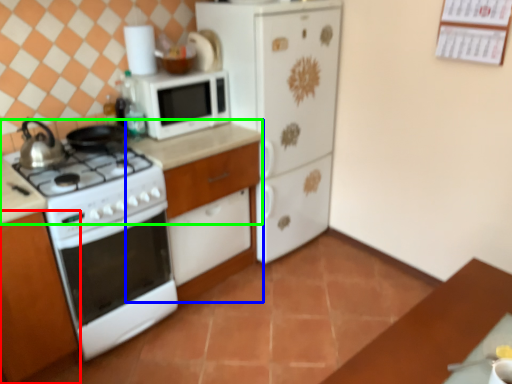
Question: Which is nearer to the cabinetry (highlighted by a red box)? dresser (highlighted by a blue box) or counter top (highlighted by a green box).

Choices:
 (A) dresser
 (B) counter top

Answer: (B)